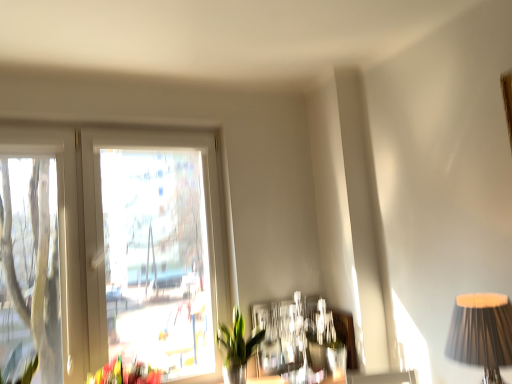
At what (x,y) coordinates should I click in order to perform the action: click on white plastic window at upper left. Please return your answer as a coordinate pair (x, y). The image size is (512, 384). Looking at the image, I should click on (100, 227).

I want to click on white plastic window at upper left, so [x=100, y=227].

In the scene shown: Considering the relative sizes of green glossy plant at lower center and green leafy plant at left in the image provided, is green glossy plant at lower center taller than green leafy plant at left?

Indeed, green glossy plant at lower center has a greater height compared to green leafy plant at left.

Does green glossy plant at lower center turn towards green leafy plant at left?

No, green glossy plant at lower center is not turned towards green leafy plant at left.

How different are the orientations of green glossy plant at lower center and green leafy plant at left in degrees?

They differ by 0.000527 degrees in their facing directions.

From a real-world perspective, between green glossy plant at lower center and green leafy plant at left, who is vertically lower?

In real-world perspective, green glossy plant at lower center is lower.

Can white plastic window at upper left be found inside green glossy plant at lower center?

That's incorrect, white plastic window at upper left is not inside green glossy plant at lower center.

Locate an element on the screen. This screenshot has height=384, width=512. window positioned vertically above the green glossy plant at lower center (from a real-world perspective) is located at coordinates (100, 227).

Measure the distance from green glossy plant at lower center to white plastic window at upper left.

The distance of green glossy plant at lower center from white plastic window at upper left is 20.20 inches.

From the image's perspective, is black pleated fabric lampshade at right on top of green glossy plant at lower center?

Correct, black pleated fabric lampshade at right appears higher than green glossy plant at lower center in the image.

Is black pleated fabric lampshade at right shorter than green glossy plant at lower center?

Yes.

From a real-world perspective, is black pleated fabric lampshade at right physically located above or below green glossy plant at lower center?

black pleated fabric lampshade at right is situated higher than green glossy plant at lower center in the real world.

Would you say black pleated fabric lampshade at right is outside green glossy plant at lower center?

Yes, black pleated fabric lampshade at right is not within green glossy plant at lower center.

Which is nearer, (x=487, y=328) or (x=98, y=221)?

The point (x=487, y=328) is in front.

Which is more to the left, black pleated fabric lampshade at right or white plastic window at upper left?

white plastic window at upper left is more to the left.

From the picture: From the image's perspective, is black pleated fabric lampshade at right above or below white plastic window at upper left?

Based on their image positions, black pleated fabric lampshade at right is located beneath white plastic window at upper left.

Looking at this image, is white plastic window at upper left wider or thinner than green leafy plant at left?

Considering their sizes, white plastic window at upper left looks slimmer than green leafy plant at left.

Is white plastic window at upper left facing away from green leafy plant at left?

That's not correct — white plastic window at upper left is not looking away from green leafy plant at left.

Who is smaller, white plastic window at upper left or green leafy plant at left?

Smaller between the two is green leafy plant at left.

Does point (219, 207) come in front of point (498, 356)?

No.

The image size is (512, 384). In the image, there is a black pleated fabric lampshade at right. Identify the location of window above it (from the image's perspective). (100, 227).

Which object is positioned more to the left, white plastic window at upper left or black pleated fabric lampshade at right?

white plastic window at upper left.

Can black pleated fabric lampshade at right be found inside white plastic window at upper left?

Actually, black pleated fabric lampshade at right is outside white plastic window at upper left.

Considering the positions of points (64, 352) and (245, 350), is point (64, 352) farther from camera compared to point (245, 350)?

No, (64, 352) is in front of (245, 350).

Is white plastic window at upper left in front of or behind green glossy plant at lower center in the image?

Clearly, white plastic window at upper left is in front of green glossy plant at lower center.

Which is more to the right, white plastic window at upper left or green glossy plant at lower center?

green glossy plant at lower center.

Could you tell me if white plastic window at upper left is turned towards green glossy plant at lower center?

Yes, white plastic window at upper left is turned towards green glossy plant at lower center.

The height and width of the screenshot is (384, 512). Find the location of `houseplant behind the green leafy plant at left`. houseplant behind the green leafy plant at left is located at coordinates (237, 348).

The width and height of the screenshot is (512, 384). Identify the location of window lying on the left of green glossy plant at lower center. (100, 227).

Estimate the real-world distances between objects in this image. Which object is closer to green glossy plant at lower center, green leafy plant at left or white plastic window at upper left?

Based on the image, white plastic window at upper left appears to be nearer to green glossy plant at lower center.

When comparing their distances from white plastic window at upper left, does green leafy plant at left or black pleated fabric lampshade at right seem further?

black pleated fabric lampshade at right lies further to white plastic window at upper left than the other object.

Based on their spatial positions, is white plastic window at upper left or black pleated fabric lampshade at right closer to green glossy plant at lower center?

white plastic window at upper left.

Which object lies further to the anchor point green glossy plant at lower center, black pleated fabric lampshade at right or white plastic window at upper left?

black pleated fabric lampshade at right.

Estimate the real-world distances between objects in this image. Which object is further from green leafy plant at left, white plastic window at upper left or black pleated fabric lampshade at right?

black pleated fabric lampshade at right is positioned further to the anchor green leafy plant at left.

Estimate the real-world distances between objects in this image. Which object is further from green glossy plant at lower center, green leafy plant at left or black pleated fabric lampshade at right?

black pleated fabric lampshade at right is positioned further to the anchor green glossy plant at lower center.

Which object lies nearer to the anchor point black pleated fabric lampshade at right, green glossy plant at lower center or green leafy plant at left?

green glossy plant at lower center lies closer to black pleated fabric lampshade at right than the other object.

Looking at the image, which one is located further to green leafy plant at left, green glossy plant at lower center or white plastic window at upper left?

Based on the image, green glossy plant at lower center appears to be further to green leafy plant at left.

You are a GUI agent. You are given a task and a screenshot of the screen. Output one action in this format:
    pyautogui.click(x=<x>, y=<y>)
    Task: Click on the window between green leafy plant at left and green glossy plant at lower center in the horizontal direction
    The width and height of the screenshot is (512, 384).
    Given the screenshot: What is the action you would take?
    pyautogui.click(x=100, y=227)

Image resolution: width=512 pixels, height=384 pixels. Identify the location of window located between green leafy plant at left and black pleated fabric lampshade at right in the left-right direction. click(x=100, y=227).

At what (x,y) coordinates should I click in order to perform the action: click on houseplant between green leafy plant at left and black pleated fabric lampshade at right. Please return your answer as a coordinate pair (x, y). Looking at the image, I should click on (237, 348).

This screenshot has width=512, height=384. In order to click on houseplant between white plastic window at upper left and black pleated fabric lampshade at right from left to right in this screenshot , I will do `click(237, 348)`.